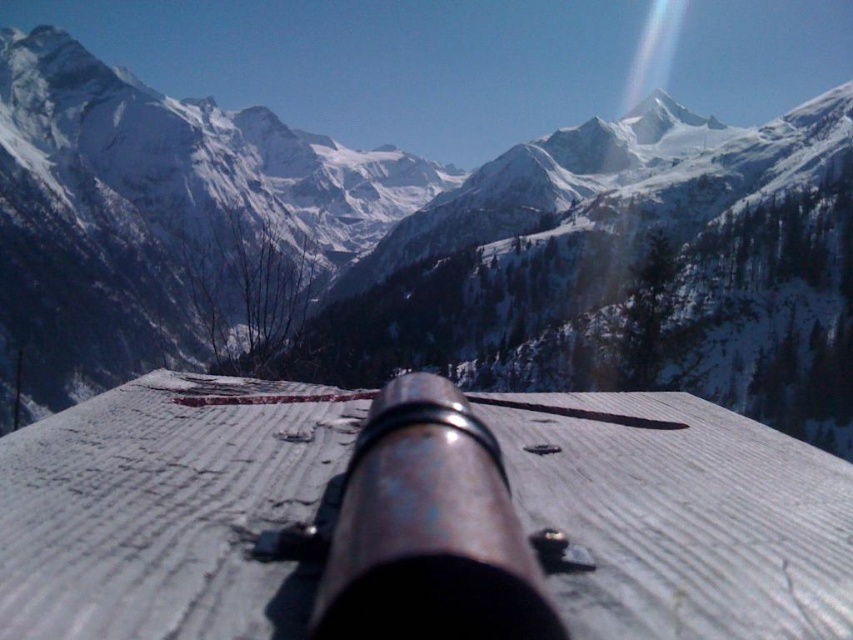
You are a photographer setting up equipment in a snowy mountain area. You have a camera placed on a wooden surface and notice the rusty metal cannon at center. Can you see the snowy rocky mountain range at upper center through the camera lens without moving the camera?

The snowy rocky mountain range at upper center is located above the rusty metal cannon at center, so yes, the photographer can see the snowy rocky mountain range at upper center through the camera lens without moving it since it is positioned above the cannon.

You are a photographer setting up equipment in a snowy landscape. You have a camera lens that needs to be aligned with the snowy rocky mountain range at upper center and the rusty metal cannon at center. According to the scene, which object is located to the left of the other?

The snowy rocky mountain range at upper center is positioned on the left side of the rusty metal cannon at center.